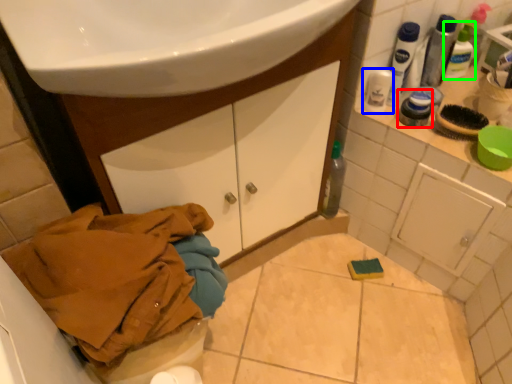
Question: Estimate the real-world distances between objects in this image. Which object is closer to toiletry (highlighted by a red box), mouthwash (highlighted by a blue box) or mouthwash (highlighted by a green box)?

Choices:
 (A) mouthwash
 (B) mouthwash

Answer: (A)